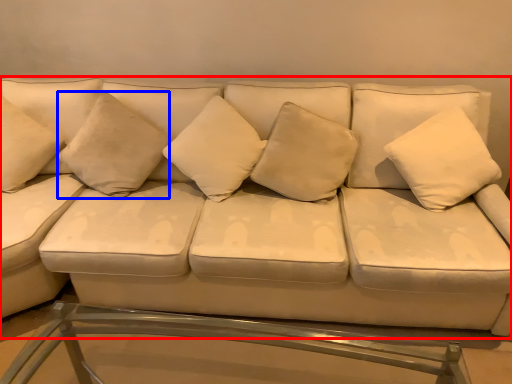
Question: Among these objects, which one is farthest to the camera, studio couch (highlighted by a red box) or pillow (highlighted by a blue box)?

Choices:
 (A) studio couch
 (B) pillow

Answer: (B)